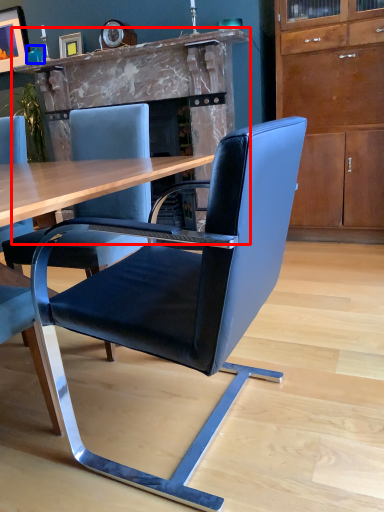
Question: Which object appears closest to the camera in this image, fireplace (highlighted by a red box) or teal (highlighted by a blue box)?

Choices:
 (A) fireplace
 (B) teal

Answer: (A)